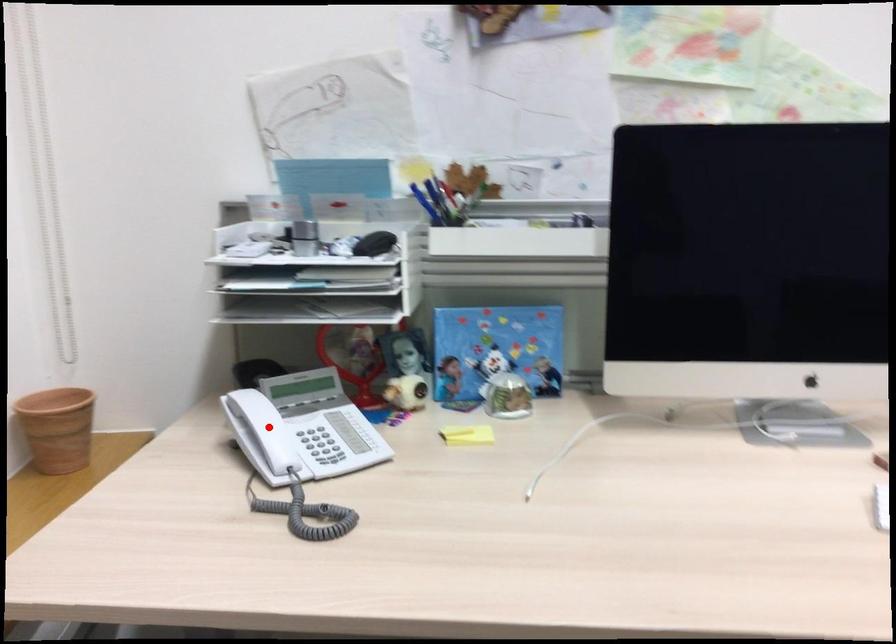
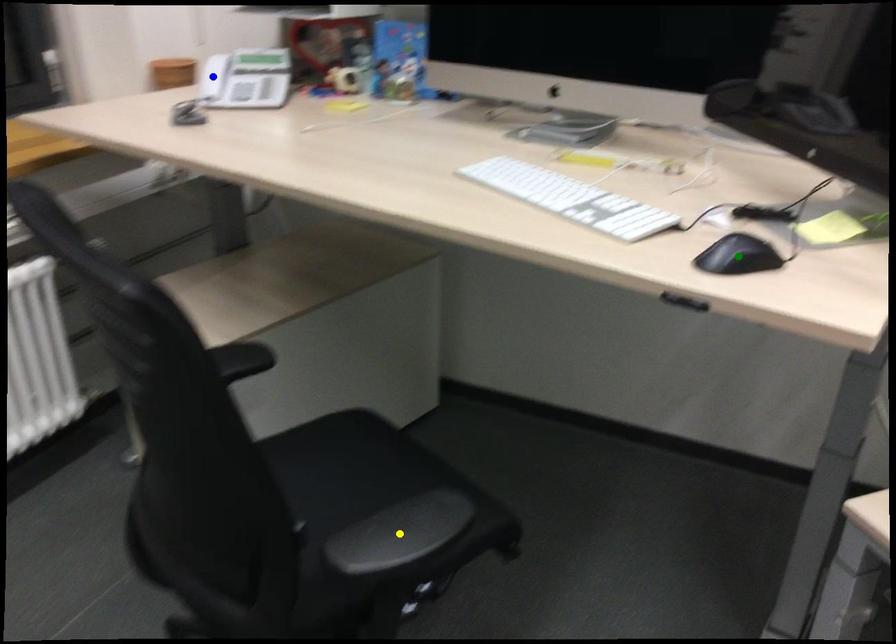
Question: I am providing you with two images of the same scene from different viewpoints. A red point is marked on the first image. You are given multiple points on the second image. Which spot in image 2 lines up with the point in image 1?

Choices:
 (A) green point
 (B) blue point
 (C) yellow point

Answer: (B)